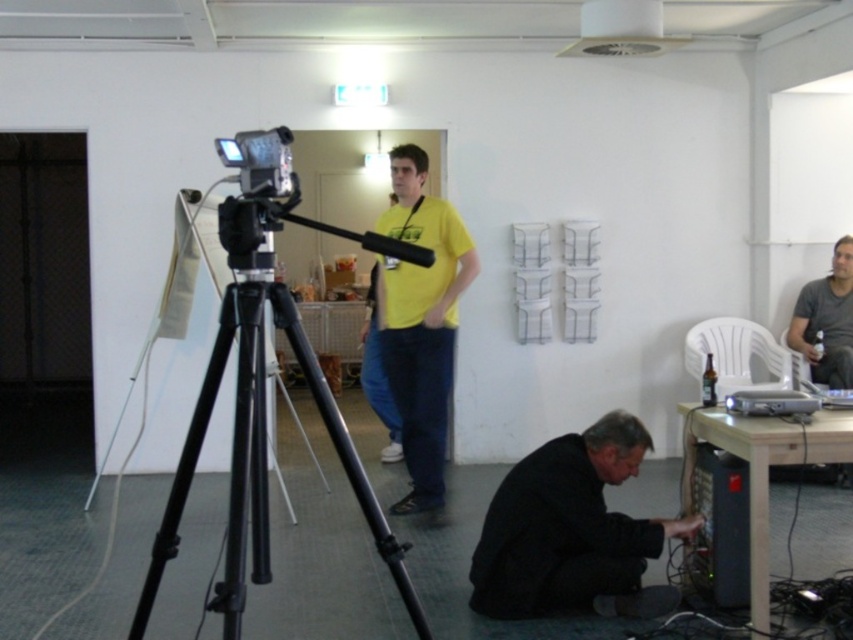
Image resolution: width=853 pixels, height=640 pixels. Describe the element at coordinates (421, 323) in the screenshot. I see `yellow matte/yellow t-shirt at center` at that location.

Does yellow matte/yellow t-shirt at center lie behind black plastic computer at lower right?

Yes, yellow matte/yellow t-shirt at center is further from the viewer.

The height and width of the screenshot is (640, 853). In order to click on yellow matte/yellow t-shirt at center in this screenshot , I will do `click(421, 323)`.

Looking at this image, who is taller, black metal tripod at center or yellow matte/yellow t-shirt at center?

With more height is yellow matte/yellow t-shirt at center.

The image size is (853, 640). Describe the element at coordinates (265, 417) in the screenshot. I see `black metal tripod at center` at that location.

Identify the location of black metal tripod at center. (265, 417).

Which is behind, point (259, 349) or point (685, 556)?

The point (685, 556) is more distant.

The width and height of the screenshot is (853, 640). Identify the location of black metal tripod at center. pyautogui.click(x=265, y=417).